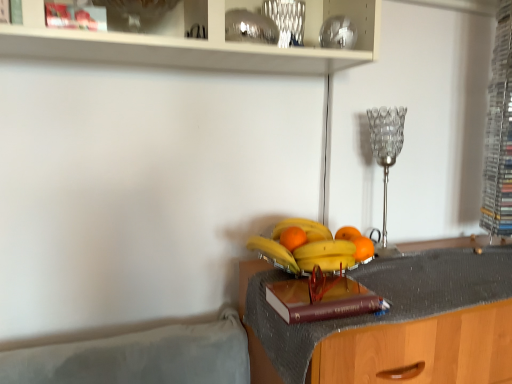
Question: Is orange matte at center bigger or smaller than maroon leather book at center?

Choices:
 (A) big
 (B) small

Answer: (B)

Question: Based on their positions, is orange matte at center located to the left or right of maroon leather book at center?

Choices:
 (A) left
 (B) right

Answer: (B)

Question: Which object is the closest to the yellow matte bananas at center, marked as the second banana in a bottom-to-top arrangement?

Choices:
 (A) yellow matte bananas at center, acting as the 3th banana starting from the top
 (B) clear plastic cds at right
 (C) yellow matte banana at center, acting as the third banana starting from the bottom
 (D) orange matte at center
 (E) orange matte at center

Answer: (D)

Question: Considering the real-world distances, which object is farthest from the orange matte at center?

Choices:
 (A) yellow matte bananas at center, acting as the 3th banana starting from the top
 (B) clear glass candlestick at center
 (C) maroon leather book at center
 (D) yellow matte bananas at center, the second banana when ordered from top to bottom
 (E) shiny metallic vase at upper center

Answer: (E)